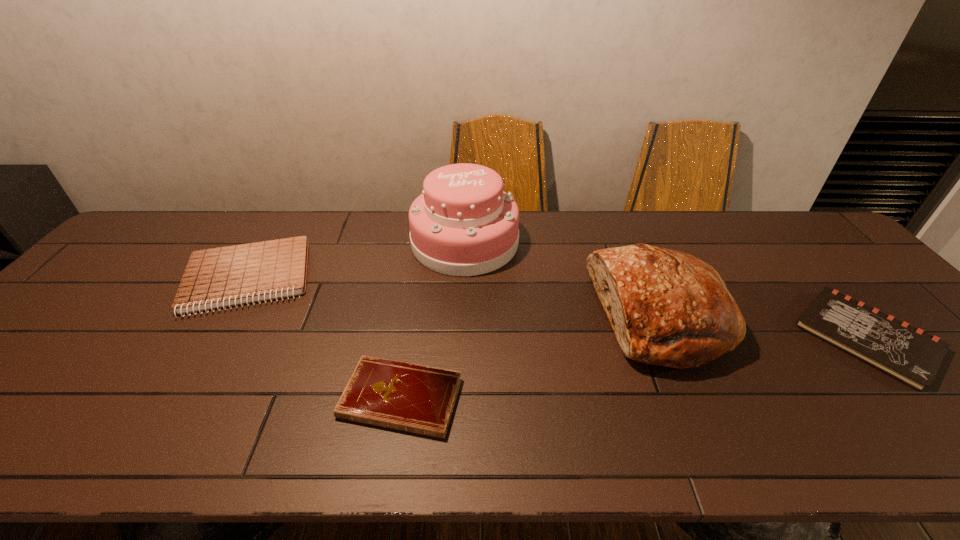
I want to click on free space located 0.050m at the sliced front of the fourth shortest object, so click(x=575, y=317).

At what (x,y) coordinates should I click in order to perform the action: click on vacant space situated on the back of the tallest notebook. Please return your answer as a coordinate pair (x, y). The height and width of the screenshot is (540, 960). Looking at the image, I should click on (279, 226).

I want to click on vacant position located 0.210m on the back of the second notebook from left to right, so click(417, 299).

At what (x,y) coordinates should I click in order to perform the action: click on birthday cake that is at the far edge. Please return your answer as a coordinate pair (x, y). Looking at the image, I should click on (463, 224).

Identify the location of notebook located at the far edge. The height and width of the screenshot is (540, 960). (227, 276).

Identify the location of object located in the near edge section of the desktop. (420, 399).

What are the coordinates of `vacant area at the far edge` in the screenshot? It's located at (655, 227).

In the image, there is a desktop. What are the coordinates of `vacant region at the near edge` in the screenshot? It's located at (660, 457).

Find the location of a particular element. free space at the left edge of the desktop is located at coordinates (46, 336).

Image resolution: width=960 pixels, height=540 pixels. In the image, there is a desktop. Find the location of `vacant space at the right edge`. vacant space at the right edge is located at coordinates (869, 305).